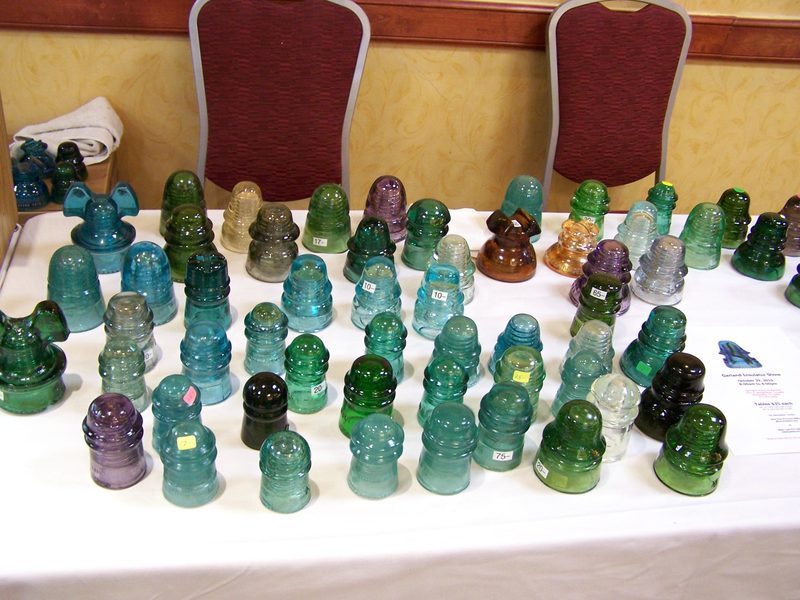
You are a GUI agent. You are given a task and a screenshot of the screen. Output one action in this format:
    pyautogui.click(x=<x>, y=<y>)
    Task: Click on the table
    
    Given the screenshot: What is the action you would take?
    pyautogui.click(x=526, y=506)